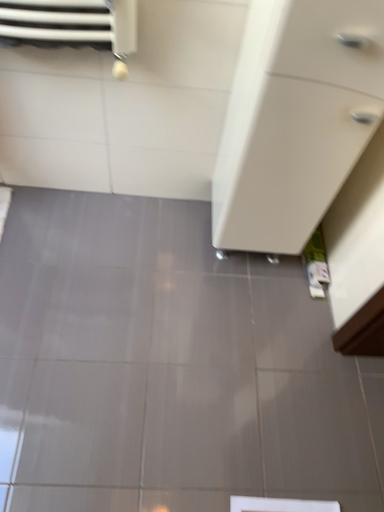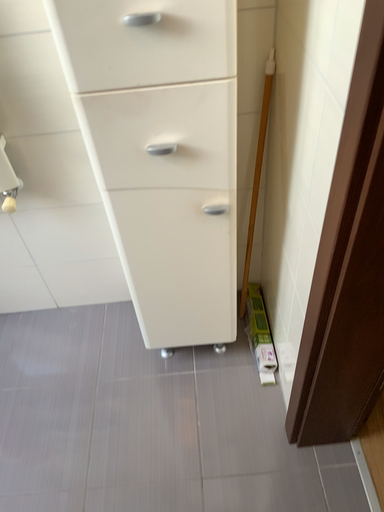
Question: Which way did the camera rotate in the video?

Choices:
 (A) rotated upward
 (B) rotated downward

Answer: (A)